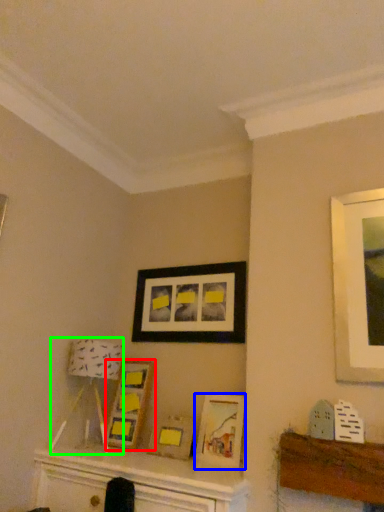
Question: Which is nearer to the picture frame (highlighted by a red box)? picture frame (highlighted by a blue box) or lamp (highlighted by a green box).

Choices:
 (A) picture frame
 (B) lamp

Answer: (B)